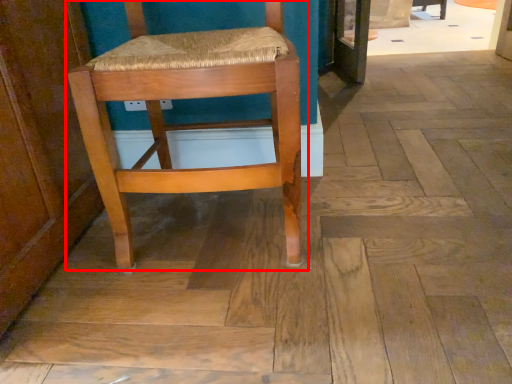
Question: Where is chair (annotated by the red box) located in relation to chair in the image?

Choices:
 (A) right
 (B) left

Answer: (B)